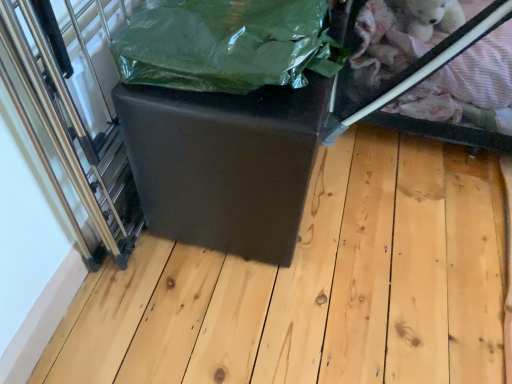
Question: Looking at their shapes, would you say matte black ottoman at center is wider or thinner than green plastic bag at center?

Choices:
 (A) wide
 (B) thin

Answer: (A)

Question: Is point (380, 259) positioned closer to the camera than point (181, 24)?

Choices:
 (A) closer
 (B) farther

Answer: (B)

Question: Which object is the closest to the transparent plastic glass door at left?

Choices:
 (A) matte black cube at center
 (B) transparent plastic glass box at upper right
 (C) green plastic bag at center
 (D) matte black ottoman at center

Answer: (A)

Question: Which object is positioned farthest from the transparent plastic glass door at left?

Choices:
 (A) transparent plastic glass box at upper right
 (B) matte black cube at center
 (C) green plastic bag at center
 (D) matte black ottoman at center

Answer: (A)